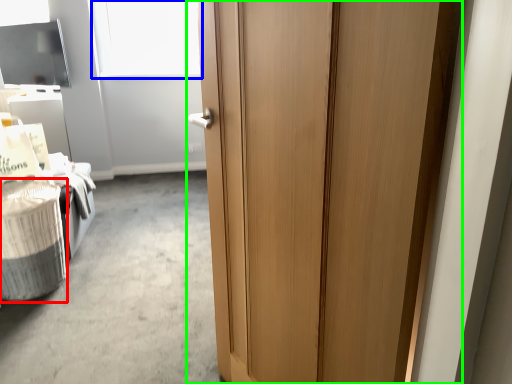
Question: Considering the real-world distances, which object is closest to laundry basket (highlighted by a red box)? window screen (highlighted by a blue box) or door (highlighted by a green box).

Choices:
 (A) window screen
 (B) door

Answer: (B)